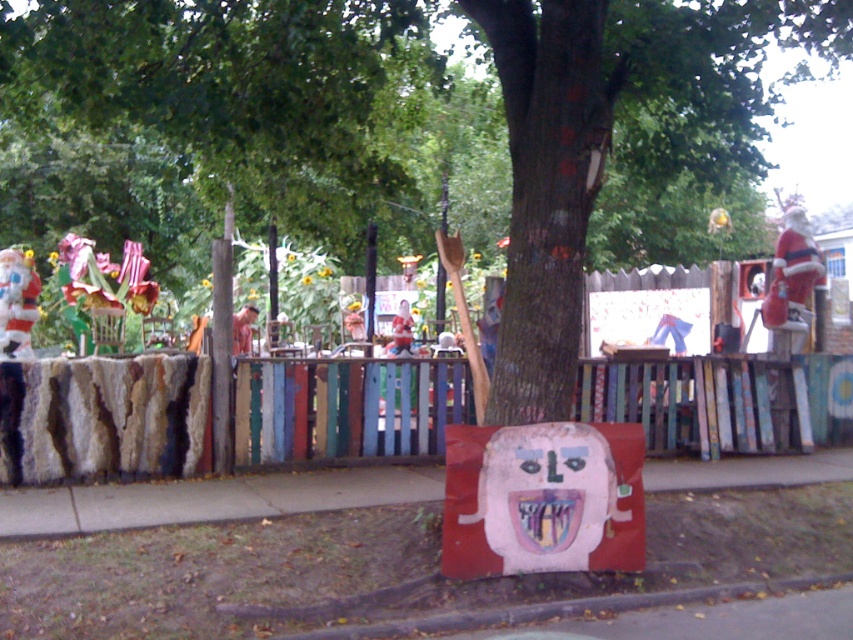
Does smooth concrete sidewalk at center have a larger size compared to wooden figure at center?

Actually, smooth concrete sidewalk at center might be smaller than wooden figure at center.

Which is in front, point (19, 538) or point (244, 326)?

Positioned in front is point (19, 538).

Where is `smooth concrete sidewalk at center`? smooth concrete sidewalk at center is located at coordinates (210, 499).

Can you confirm if green leafy tree at center is thinner than wooden figure at center?

In fact, green leafy tree at center might be wider than wooden figure at center.

Identify the location of green leafy tree at center. This screenshot has height=640, width=853. (409, 134).

Does point (595, 180) lie in front of point (235, 332)?

Yes.

Identify the location of green leafy tree at center. Image resolution: width=853 pixels, height=640 pixels. (409, 134).

At what (x,y) coordinates should I click in order to perform the action: click on green leafy tree at center. Please return your answer as a coordinate pair (x, y). This screenshot has width=853, height=640. Looking at the image, I should click on (409, 134).

Who is shorter, green leafy tree at center or smooth concrete sidewalk at center?

smooth concrete sidewalk at center

Between point (196, 195) and point (189, 492), which one is positioned behind?

Positioned behind is point (196, 195).

Identify the location of green leafy tree at center. (409, 134).